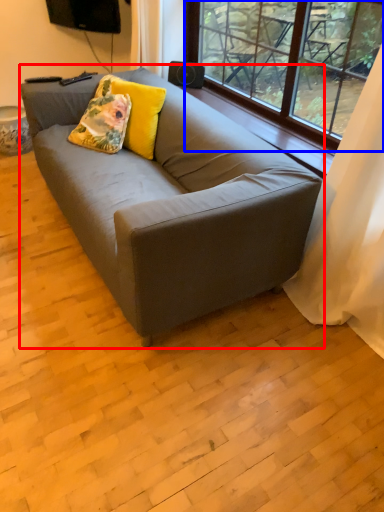
Question: Which of the following is the farthest to the observer, studio couch (highlighted by a red box) or window (highlighted by a blue box)?

Choices:
 (A) studio couch
 (B) window

Answer: (B)